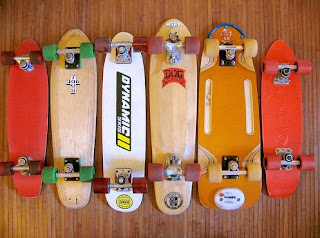
Locate an element on the screen. Image resolution: width=320 pixels, height=238 pixels. wood floor is located at coordinates (174, 230).